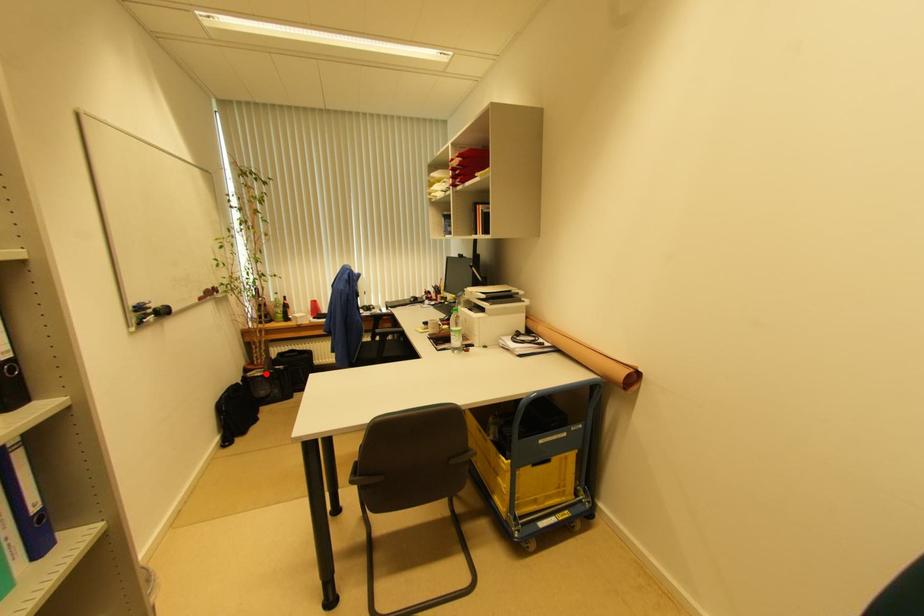
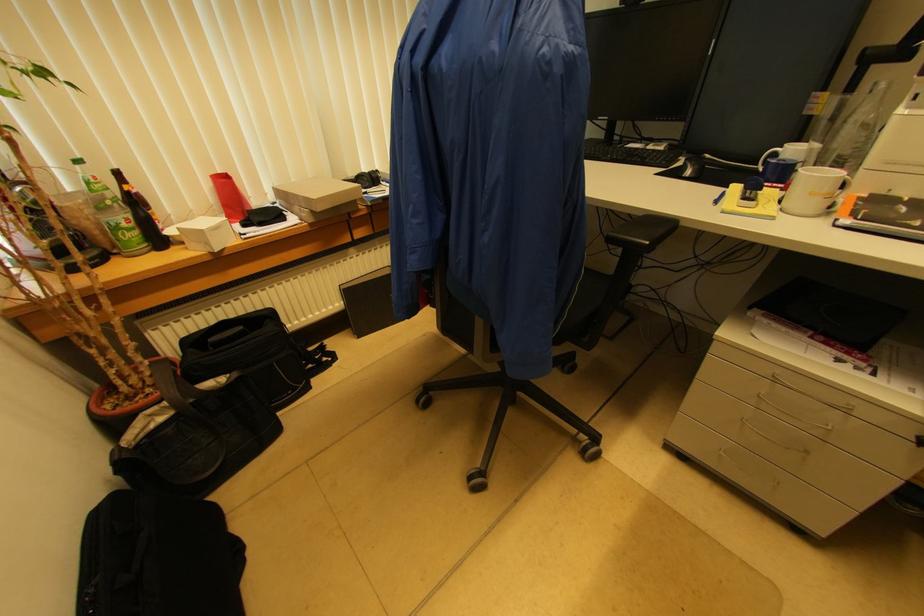
Question: A red point is marked in image1. In image2, is the corresponding 3D point closer to the camera or farther? Reply with the corresponding letter.

Choices:
 (A) The corresponding 3D point is closer.
 (B) The corresponding 3D point is farther.

Answer: (A)